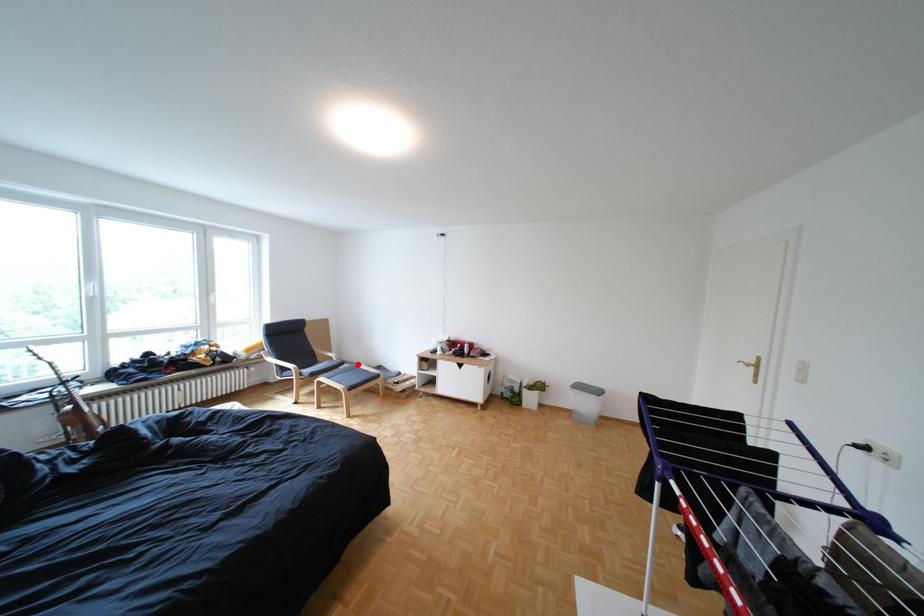
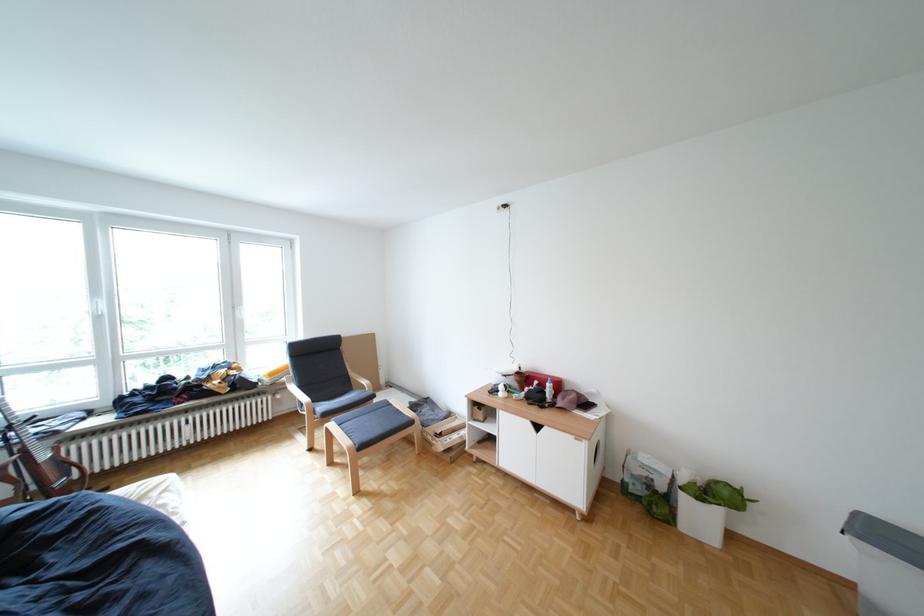
Question: A red point is marked in image1. In image2, is the corresponding 3D point closer to the camera or farther? Reply with the corresponding letter.

Choices:
 (A) The corresponding 3D point is closer.
 (B) The corresponding 3D point is farther.

Answer: (A)